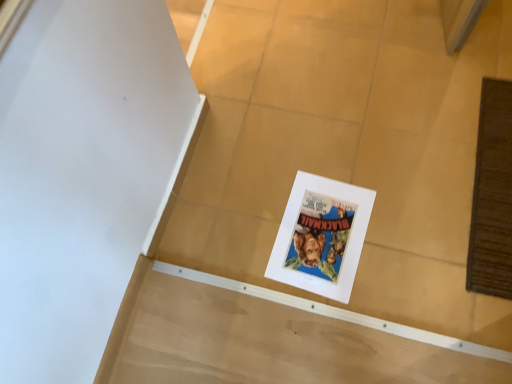
The width and height of the screenshot is (512, 384). What are the coordinates of `vacant space situated above matte paper poster at center (from a real-world perspective)` in the screenshot? It's located at (324, 236).